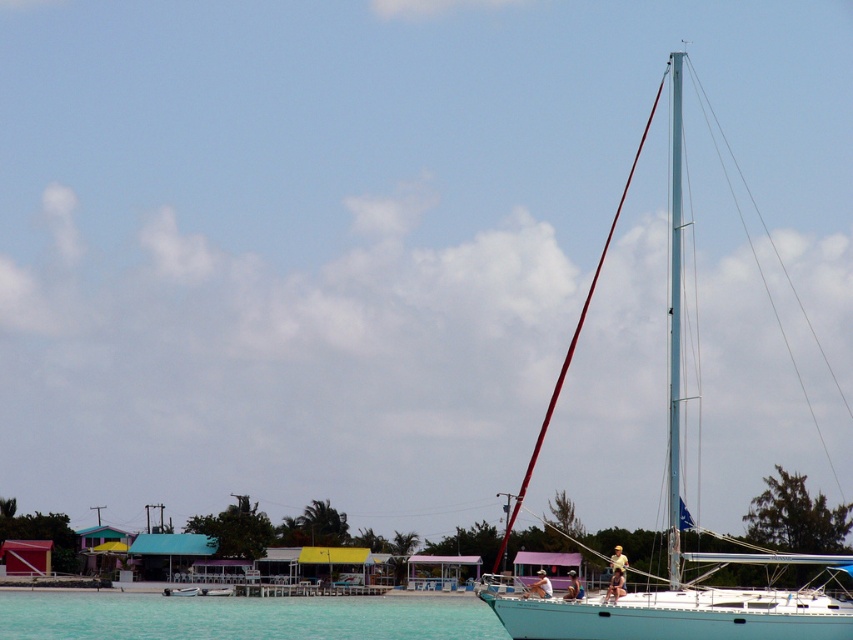
Is teal matte sailboat at right behind clear blue water at lower left?

No, it is in front of clear blue water at lower left.

Who is more distant from viewer, (x=733, y=616) or (x=113, y=604)?

The point (x=113, y=604) is more distant.

Does point (813, 609) lie behind point (223, 616)?

No, (813, 609) is in front of (223, 616).

The height and width of the screenshot is (640, 853). I want to click on teal matte sailboat at right, so click(x=679, y=538).

Is point (287, 600) positioned before point (676, 211)?

No.

Is point (103, 605) farther from viewer compared to point (671, 147)?

No.

Describe the element at coordinates (241, 616) in the screenshot. I see `clear blue water at lower left` at that location.

At what (x,y) coordinates should I click in order to perform the action: click on clear blue water at lower left. Please return your answer as a coordinate pair (x, y). Looking at the image, I should click on (241, 616).

Does point (688, 614) lie behind point (677, 365)?

No.

Find the location of a particular element. teal matte sailboat at right is located at coordinates (679, 538).